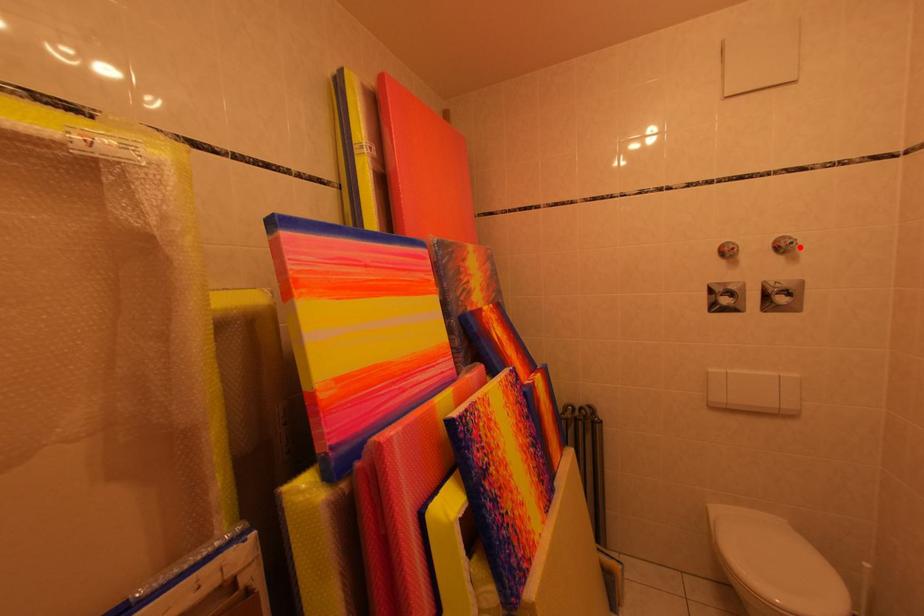
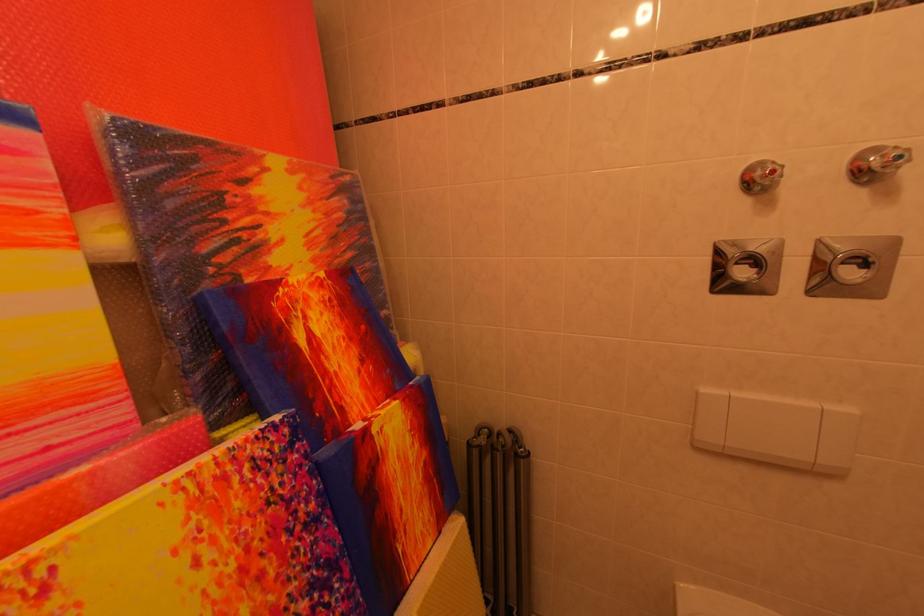
Question: I am providing you with two images of the same scene from different viewpoints. Given a red point in image1, look at the same physical point in image2. Is it:

Choices:
 (A) Closer to the viewpoint
 (B) Farther from the viewpoint

Answer: (B)